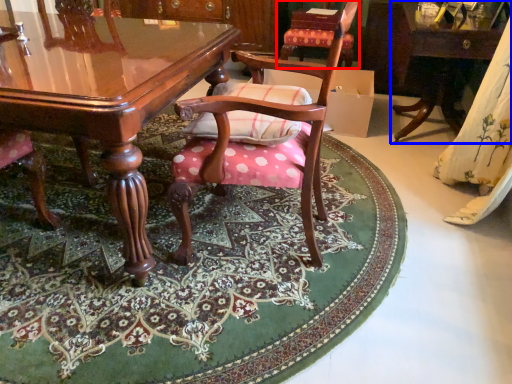
Question: Which point is further to the camera, chair (highlighted by a red box) or table (highlighted by a blue box)?

Choices:
 (A) chair
 (B) table

Answer: (A)